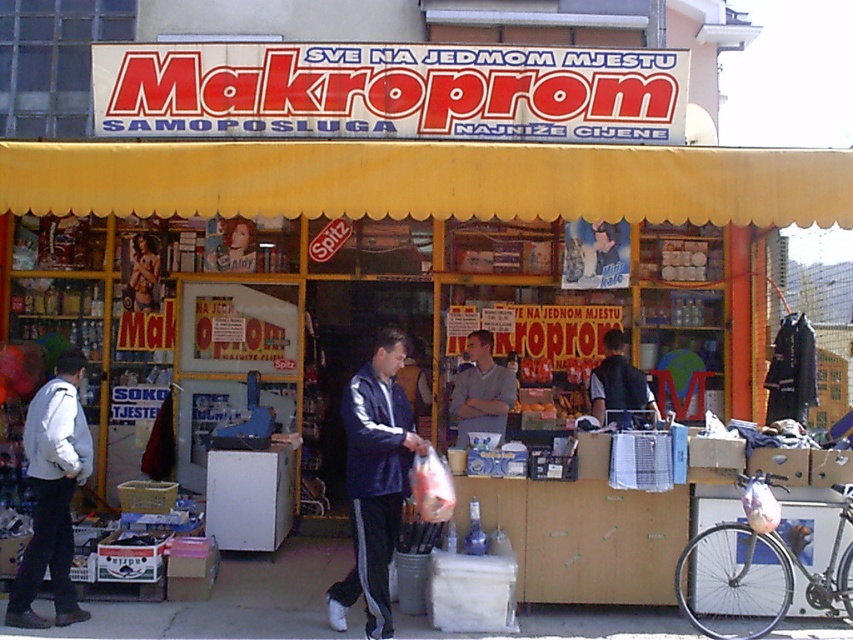
Can you confirm if yellow fabric canopy at upper center is shorter than light gray jacket at left?

Correct, yellow fabric canopy at upper center is not as tall as light gray jacket at left.

Does yellow fabric canopy at upper center have a greater width compared to light gray jacket at left?

A: Correct, the width of yellow fabric canopy at upper center exceeds that of light gray jacket at left.

What do you see at coordinates (430, 180) in the screenshot? I see `yellow fabric canopy at upper center` at bounding box center [430, 180].

At what (x,y) coordinates should I click in order to perform the action: click on yellow fabric canopy at upper center. Please return your answer as a coordinate pair (x, y). Looking at the image, I should click on (430, 180).

Is point (471, 412) more distant than point (604, 348)?

No, it is in front of (604, 348).

Is point (474, 400) more distant than point (624, 376)?

Yes, point (474, 400) is behind point (624, 376).

The width and height of the screenshot is (853, 640). Identify the location of light gray sweater at center. pyautogui.click(x=480, y=390).

Does yellow fabric canopy at upper center have a greater width compared to dark blue track suit at center?

Yes.

Does yellow fabric canopy at upper center appear on the right side of dark blue track suit at center?

Indeed, yellow fabric canopy at upper center is positioned on the right side of dark blue track suit at center.

Which is behind, point (463, 214) or point (410, 426)?

The point (463, 214) is more distant.

Locate an element on the screen. Image resolution: width=853 pixels, height=640 pixels. yellow fabric canopy at upper center is located at coordinates 430,180.